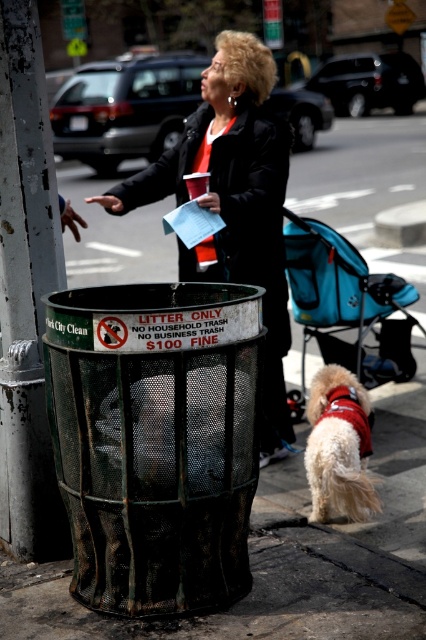
Question: Based on their relative distances, which object is farther from the green painted metal pole at left?

Choices:
 (A) black leather jacket at center
 (B) fluffy white dog at lower right

Answer: (A)

Question: From the image, what is the correct spatial relationship of green painted metal pole at left in relation to blue fabric stroller at center?

Choices:
 (A) below
 (B) above

Answer: (A)

Question: Estimate the real-world distances between objects in this image. Which object is closer to the fluffy white dog at lower right?

Choices:
 (A) green painted metal pole at left
 (B) black leather jacket at center

Answer: (B)

Question: Does blue fabric stroller at center have a lesser width compared to fluffy white dog at lower right?

Choices:
 (A) yes
 (B) no

Answer: (B)

Question: Does green painted metal pole at left have a larger size compared to fluffy white dog at lower right?

Choices:
 (A) no
 (B) yes

Answer: (B)

Question: Which point is closer to the camera?

Choices:
 (A) green painted metal pole at left
 (B) fluffy white dog at lower right
 (C) black leather jacket at center
 (D) blue fabric stroller at center

Answer: (A)